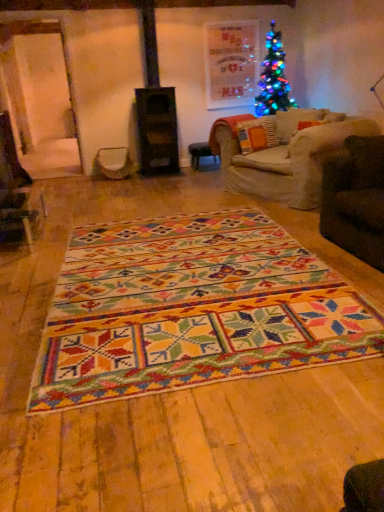
What do you see at coordinates (113, 163) in the screenshot? This screenshot has width=384, height=512. I see `metallic silver swivel chair at center` at bounding box center [113, 163].

The width and height of the screenshot is (384, 512). Describe the element at coordinates (192, 309) in the screenshot. I see `multicolored woven rug at center` at that location.

Image resolution: width=384 pixels, height=512 pixels. Describe the element at coordinates (256, 134) in the screenshot. I see `textured orange pillow at center` at that location.

You are a GUI agent. You are given a task and a screenshot of the screen. Output one action in this format:
    pyautogui.click(x=<x>, y=<y>)
    Task: Click on the metallic silver swivel chair at center
    
    Given the screenshot: What is the action you would take?
    pyautogui.click(x=113, y=163)

Does wooden stool at center turn towards multicolored woven rug at center?

Yes.

From the image's perspective, is wooden stool at center positioned above or below multicolored woven rug at center?

Based on their image positions, wooden stool at center is located above multicolored woven rug at center.

Considering the relative positions of wooden stool at center and multicolored woven rug at center in the image provided, is wooden stool at center behind multicolored woven rug at center?

Yes.

From a real-world perspective, which is physically below, wooden stool at center or multicolored woven rug at center?

In real-world perspective, multicolored woven rug at center is lower.

Considering the relative sizes of wooden stool at center and textured orange pillow at center in the image provided, is wooden stool at center wider than textured orange pillow at center?

Correct, the width of wooden stool at center exceeds that of textured orange pillow at center.

Does wooden stool at center touch textured orange pillow at center?

No, wooden stool at center is not beside textured orange pillow at center.

Which point is more forward, (206, 147) or (250, 142)?

The point (250, 142) is closer.

Based on the photo, is textured orange pillow at center at the back of wooden stool at center?

That's not correct — wooden stool at center is not looking away from textured orange pillow at center.

Considering the sizes of objects multicolored woven rug at center and textured orange pillow at center in the image provided, who is bigger, multicolored woven rug at center or textured orange pillow at center?

With larger size is multicolored woven rug at center.

Is multicolored woven rug at center positioned before textured orange pillow at center?

Yes, multicolored woven rug at center is in front of textured orange pillow at center.

Between multicolored woven rug at center and textured orange pillow at center, which one has more height?

Standing taller between the two is textured orange pillow at center.

From the image's perspective, who appears lower, multicolored woven rug at center or textured orange pillow at center?

From the image's view, multicolored woven rug at center is below.

Is there a large distance between textured orange pillow at center and metallic silver swivel chair at center?

textured orange pillow at center is positioned a significant distance from metallic silver swivel chair at center.

Is textured orange pillow at center completely or partially outside of metallic silver swivel chair at center?

textured orange pillow at center lies outside metallic silver swivel chair at center's area.

Is textured orange pillow at center looking in the opposite direction of metallic silver swivel chair at center?

No, textured orange pillow at center is not facing the opposite direction of metallic silver swivel chair at center.

Which is in front, multicolored woven rug at center or wooden stool at center?

multicolored woven rug at center is more forward.

Is multicolored woven rug at center thinner than wooden stool at center?

Incorrect, the width of multicolored woven rug at center is not less than that of wooden stool at center.

Which is closer, (164,348) or (205,149)?

Point (164,348).

From a real-world perspective, is multicolored woven rug at center located higher than wooden stool at center?

No, from a real-world perspective, multicolored woven rug at center is not above wooden stool at center.

Between multicolored woven rug at center and metallic silver swivel chair at center, which one has larger width?

multicolored woven rug at center is wider.

Considering the relative sizes of multicolored woven rug at center and metallic silver swivel chair at center in the image provided, is multicolored woven rug at center bigger than metallic silver swivel chair at center?

Yes.

Is multicolored woven rug at center to the left or to the right of metallic silver swivel chair at center in the image?

From the image, it's evident that multicolored woven rug at center is to the right of metallic silver swivel chair at center.

Is metallic silver swivel chair at center spatially inside wooden stool at center, or outside of it?

metallic silver swivel chair at center is not enclosed by wooden stool at center.

Based on the photo, is metallic silver swivel chair at center in front of or behind wooden stool at center in the image?

In the image, metallic silver swivel chair at center appears in front of wooden stool at center.

Based on their sizes in the image, would you say metallic silver swivel chair at center is bigger or smaller than wooden stool at center?

Considering their sizes, metallic silver swivel chair at center takes up more space than wooden stool at center.

Could you tell me if metallic silver swivel chair at center is facing wooden stool at center?

No, metallic silver swivel chair at center is not aimed at wooden stool at center.

I want to click on table above the multicolored woven rug at center (from a real-world perspective), so click(x=200, y=154).

You are a GUI agent. You are given a task and a screenshot of the screen. Output one action in this format:
    pyautogui.click(x=<x>, y=<y>)
    Task: Click on the table behind the textured orange pillow at center
    The image size is (384, 512).
    Given the screenshot: What is the action you would take?
    pyautogui.click(x=200, y=154)

From the image, which object appears to be farther from textured orange pillow at center, multicolored woven rug at center or wooden stool at center?

Among the two, multicolored woven rug at center is located further to textured orange pillow at center.

When comparing their distances from wooden stool at center, does metallic silver swivel chair at center or multicolored woven rug at center seem closer?

The object closer to wooden stool at center is metallic silver swivel chair at center.

When comparing their distances from wooden stool at center, does multicolored woven rug at center or metallic silver swivel chair at center seem closer?

Among the two, metallic silver swivel chair at center is located nearer to wooden stool at center.

From the image, which object appears to be farther from metallic silver swivel chair at center, textured orange pillow at center or multicolored woven rug at center?

multicolored woven rug at center is positioned further to the anchor metallic silver swivel chair at center.

Estimate the real-world distances between objects in this image. Which object is closer to multicolored woven rug at center, metallic silver swivel chair at center or wooden stool at center?

The object closer to multicolored woven rug at center is metallic silver swivel chair at center.

When comparing their distances from metallic silver swivel chair at center, does multicolored woven rug at center or wooden stool at center seem closer?

wooden stool at center is positioned closer to the anchor metallic silver swivel chair at center.

Which object lies nearer to the anchor point multicolored woven rug at center, wooden stool at center or metallic silver swivel chair at center?

Based on the image, metallic silver swivel chair at center appears to be nearer to multicolored woven rug at center.

Considering their positions, is multicolored woven rug at center positioned further to textured orange pillow at center than metallic silver swivel chair at center?

multicolored woven rug at center is positioned further to the anchor textured orange pillow at center.

The height and width of the screenshot is (512, 384). I want to click on pillow between multicolored woven rug at center and metallic silver swivel chair at center along the z-axis, so click(256, 134).

Where is `table between metallic silver swivel chair at center and textured orange pillow at center from left to right`? table between metallic silver swivel chair at center and textured orange pillow at center from left to right is located at coordinates (200, 154).

Find the location of a particular element. The image size is (384, 512). pillow between multicolored woven rug at center and wooden stool at center in the front-back direction is located at coordinates (x=256, y=134).

The width and height of the screenshot is (384, 512). What are the coordinates of `swivel chair between multicolored woven rug at center and wooden stool at center in the front-back direction` in the screenshot? It's located at (113, 163).